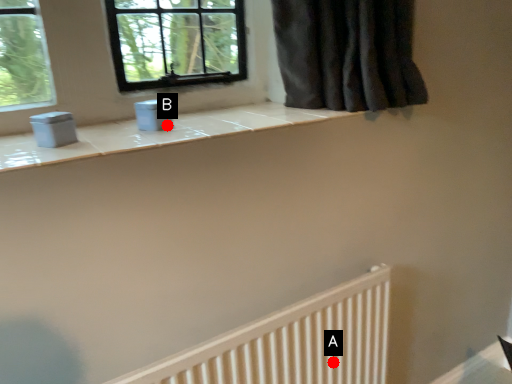
Question: Two points are circled on the image, labeled by A and B beside each circle. Which point is further to the camera?

Choices:
 (A) A is further
 (B) B is further

Answer: (A)